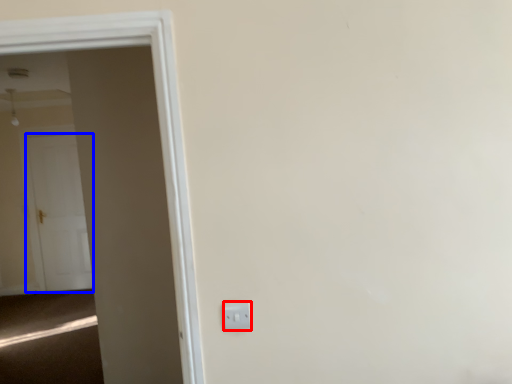
Question: Among these objects, which one is nearest to the camera, electric outlet (highlighted by a red box) or door (highlighted by a blue box)?

Choices:
 (A) electric outlet
 (B) door

Answer: (A)